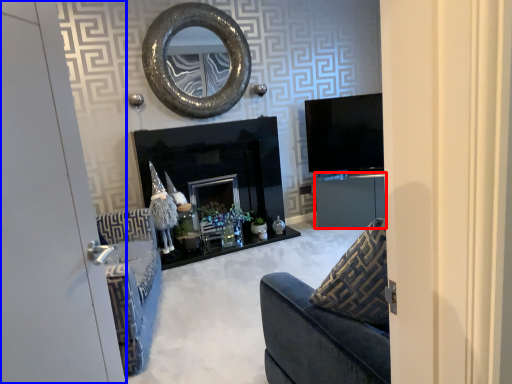
Question: Which point is further to the camera, cabinetry (highlighted by a red box) or door (highlighted by a blue box)?

Choices:
 (A) cabinetry
 (B) door

Answer: (A)